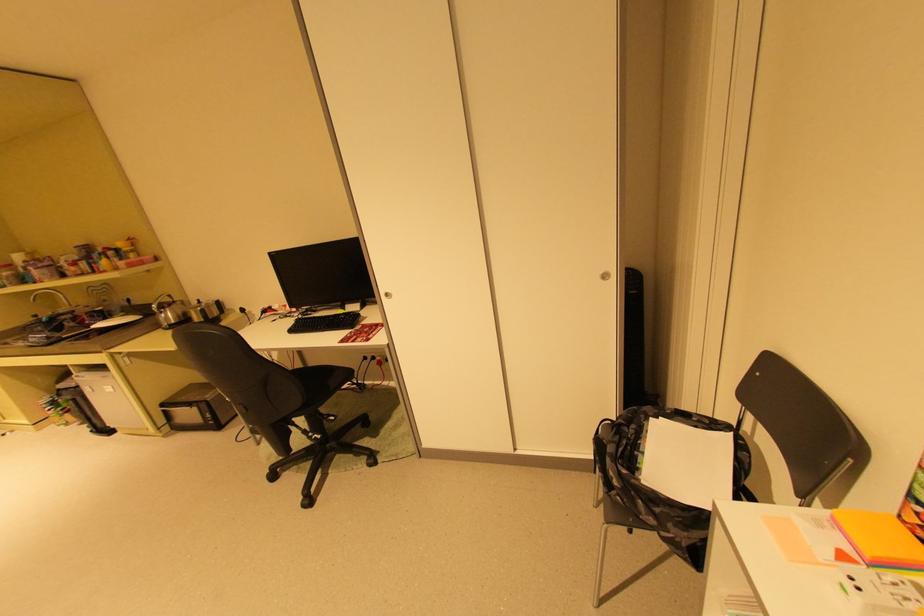
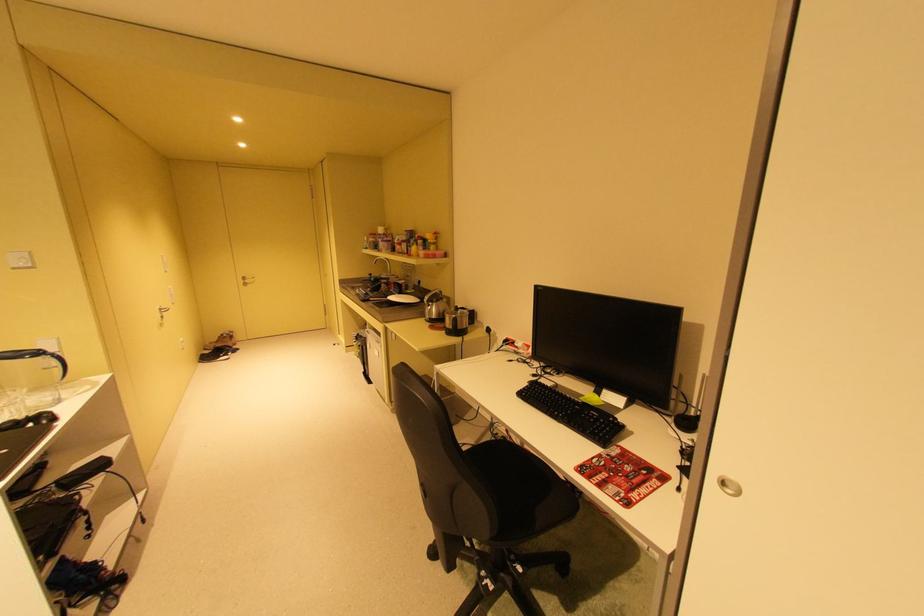
Question: The camera is either moving clockwise (left) or counter-clockwise (right) around the object. The first image is from the beginning of the video and the second image is from the end. Is the camera moving left or right when shooting the video?

Choices:
 (A) Left
 (B) Right

Answer: (B)